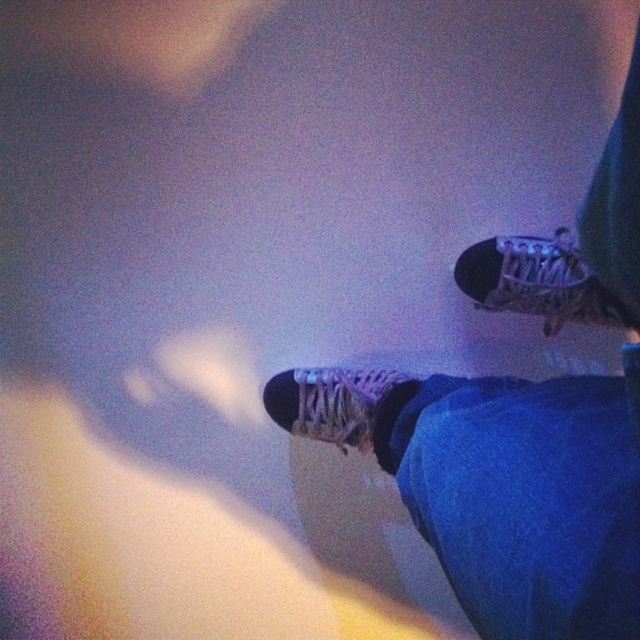
Question: Which of the following is the farthest from the observer?

Choices:
 (A) (616, 316)
 (B) (534, 266)

Answer: (B)

Question: Does matte white sneaker at upper right appear under matte white sneaker at center?

Choices:
 (A) no
 (B) yes

Answer: (A)

Question: Which point appears closest to the camera in this image?

Choices:
 (A) (522, 253)
 (B) (358, 424)

Answer: (A)

Question: Which object is closer to the camera taking this photo?

Choices:
 (A) matte white sneaker at center
 (B) matte black skateboard at lower right

Answer: (B)

Question: Is matte white sneaker at upper right closer to the viewer compared to matte white sneaker at center?

Choices:
 (A) no
 (B) yes

Answer: (B)

Question: Considering the relative positions of matte white sneaker at upper right and matte white sneaker at center in the image provided, where is matte white sneaker at upper right located with respect to matte white sneaker at center?

Choices:
 (A) right
 (B) left

Answer: (A)